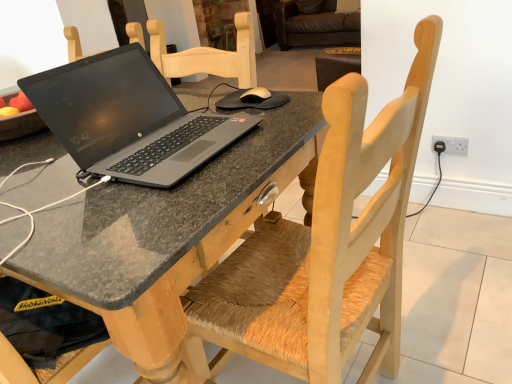
Where is `white plastic electrical outlet at right`? This screenshot has width=512, height=384. white plastic electrical outlet at right is located at coordinates (452, 144).

Locate an element on the screen. matte black laptop at center is located at coordinates (128, 119).

The image size is (512, 384). I want to click on desk above the wooden chair with woven seat at center (from the image's perspective), so click(165, 232).

Does point (364, 81) come behind point (203, 249)?

No.

Is wooden chair with woven seat at center beside granite table at center?

No, wooden chair with woven seat at center is not making contact with granite table at center.

Considering the sizes of objects wooden chair with woven seat at center and granite table at center in the image provided, who is smaller, wooden chair with woven seat at center or granite table at center?

wooden chair with woven seat at center is smaller.

The height and width of the screenshot is (384, 512). I want to click on electric outlet on the right of matte black laptop at center, so click(x=452, y=144).

Which object is closer to the camera, white plastic electrical outlet at right or matte black laptop at center?

matte black laptop at center is closer to the camera.

Is matte black laptop at center a part of white plastic electrical outlet at right?

No, matte black laptop at center is not surrounded by white plastic electrical outlet at right.

Looking at this image, between wooden chair with woven seat at center and matte black laptop at center, which one appears on the right side from the viewer's perspective?

Positioned to the right is wooden chair with woven seat at center.

I want to click on laptop on the left of the wooden chair with woven seat at center, so click(x=128, y=119).

Based on the photo, is wooden chair with woven seat at center with matte black laptop at center?

No, wooden chair with woven seat at center is not with matte black laptop at center.

Considering the relative sizes of wooden chair with woven seat at center and matte black laptop at center in the image provided, is wooden chair with woven seat at center thinner than matte black laptop at center?

No, wooden chair with woven seat at center is not thinner than matte black laptop at center.

Does point (249, 311) come behind point (432, 136)?

No, (249, 311) is in front of (432, 136).

Can you confirm if wooden chair with woven seat at center is wider than white plastic electrical outlet at right?

Indeed, wooden chair with woven seat at center has a greater width compared to white plastic electrical outlet at right.

From a real-world perspective, which is physically below, wooden chair with woven seat at center or white plastic electrical outlet at right?

From a 3D spatial view, white plastic electrical outlet at right is below.

Based on the photo, how distant is wooden chair with woven seat at center from white plastic electrical outlet at right?

They are 1.22 meters apart.

How much distance is there between matte black laptop at center and wooden chair with woven seat at center?

matte black laptop at center and wooden chair with woven seat at center are 16.81 inches apart.

Is matte black laptop at center wider or thinner than wooden chair with woven seat at center?

Considering their sizes, matte black laptop at center looks slimmer than wooden chair with woven seat at center.

From the image's perspective, is matte black laptop at center located above or below wooden chair with woven seat at center?

matte black laptop at center is above wooden chair with woven seat at center.

Is matte black laptop at center looking in the opposite direction of wooden chair with woven seat at center?

That's not correct — matte black laptop at center is not looking away from wooden chair with woven seat at center.

Does granite table at center turn towards white plastic electrical outlet at right?

No, granite table at center is not facing towards white plastic electrical outlet at right.

Does granite table at center have a greater width compared to white plastic electrical outlet at right?

Yes.

Who is bigger, granite table at center or white plastic electrical outlet at right?

granite table at center.

From the image's perspective, is granite table at center under white plastic electrical outlet at right?

Yes, from the image's perspective, granite table at center is beneath white plastic electrical outlet at right.

In the scene shown: Is matte black laptop at center located outside white plastic electrical outlet at right?

matte black laptop at center lies outside white plastic electrical outlet at right's area.

Is matte black laptop at center next to white plastic electrical outlet at right and touching it?

No, matte black laptop at center is not touching white plastic electrical outlet at right.

Is matte black laptop at center aimed at white plastic electrical outlet at right?

No, matte black laptop at center is not facing towards white plastic electrical outlet at right.

What's the angular difference between matte black laptop at center and white plastic electrical outlet at right's facing directions?

There is a 91.6-degree angle between the facing directions of matte black laptop at center and white plastic electrical outlet at right.

You are a GUI agent. You are given a task and a screenshot of the screen. Output one action in this format:
    pyautogui.click(x=<x>, y=<y>)
    Task: Click on the chair that appears on the right of granite table at center
    This screenshot has width=512, height=384.
    Given the screenshot: What is the action you would take?
    pyautogui.click(x=328, y=246)

Find the location of a particular element. This screenshot has height=384, width=512. laptop above the white plastic electrical outlet at right (from a real-world perspective) is located at coordinates (128, 119).

When comparing their distances from wooden chair with woven seat at center, does matte black laptop at center or granite table at center seem further?

matte black laptop at center.

Which object lies nearer to the anchor point white plastic electrical outlet at right, matte black laptop at center or granite table at center?

matte black laptop at center is closer to white plastic electrical outlet at right.

Considering their positions, is granite table at center positioned further to wooden chair with woven seat at center than matte black laptop at center?

matte black laptop at center lies further to wooden chair with woven seat at center than the other object.

Which object lies nearer to the anchor point wooden chair with woven seat at center, white plastic electrical outlet at right or granite table at center?

Based on the image, granite table at center appears to be nearer to wooden chair with woven seat at center.

From the picture: Looking at the image, which one is located closer to matte black laptop at center, wooden chair with woven seat at center or white plastic electrical outlet at right?

The object closer to matte black laptop at center is wooden chair with woven seat at center.

Based on their spatial positions, is white plastic electrical outlet at right or granite table at center closer to matte black laptop at center?

granite table at center.

Looking at the image, which one is located closer to white plastic electrical outlet at right, matte black laptop at center or wooden chair with woven seat at center?

wooden chair with woven seat at center.

Consider the image. Looking at the image, which one is located closer to wooden chair with woven seat at center, granite table at center or white plastic electrical outlet at right?

granite table at center lies closer to wooden chair with woven seat at center than the other object.

You are a GUI agent. You are given a task and a screenshot of the screen. Output one action in this format:
    pyautogui.click(x=<x>, y=<y>)
    Task: Click on the laptop between granite table at center and wooden chair with woven seat at center in the horizontal direction
    
    Given the screenshot: What is the action you would take?
    pyautogui.click(x=128, y=119)

The height and width of the screenshot is (384, 512). Find the location of `desk positioned between wooden chair with woven seat at center and white plastic electrical outlet at right from near to far`. desk positioned between wooden chair with woven seat at center and white plastic electrical outlet at right from near to far is located at coordinates (165, 232).

Where is `laptop located between granite table at center and white plastic electrical outlet at right in the left-right direction`? This screenshot has width=512, height=384. laptop located between granite table at center and white plastic electrical outlet at right in the left-right direction is located at coordinates (128, 119).

At what (x,y) coordinates should I click in order to perform the action: click on laptop between wooden chair with woven seat at center and white plastic electrical outlet at right in the front-back direction. Please return your answer as a coordinate pair (x, y). Looking at the image, I should click on (128, 119).